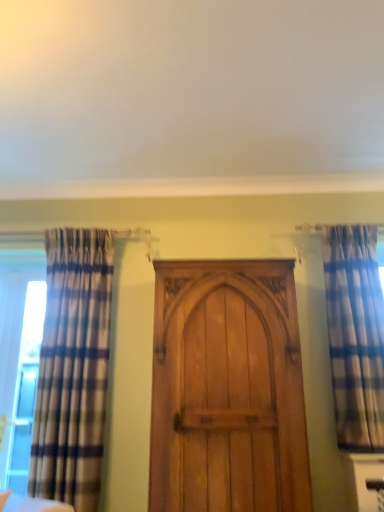
At what (x,y) coordinates should I click in order to perform the action: click on clear glass window at left. Please return your answer as a coordinate pair (x, y). This screenshot has height=512, width=384. Looking at the image, I should click on (19, 358).

What do you see at coordinates (31, 504) in the screenshot?
I see `wooden door at center` at bounding box center [31, 504].

In order to click on plaid fabric curtain at left, the second curtain in the right-to-left sequence in this screenshot , I will do `click(73, 369)`.

At what (x,y) coordinates should I click in order to perform the action: click on plaid fabric curtain at right, the 2th curtain when ordered from left to right. Please return your answer as a coordinate pair (x, y). The width and height of the screenshot is (384, 512). Looking at the image, I should click on (355, 335).

What's the angular difference between light brown wood door at center and wooden door at center's facing directions?

They differ by 36.6 degrees in their facing directions.

Is point (219, 308) farther from camera compared to point (15, 507)?

Yes, point (219, 308) is behind point (15, 507).

Considering the relative positions of light brown wood door at center and wooden door at center in the image provided, is light brown wood door at center in front of wooden door at center?

No.

Could you tell me if light brown wood door at center is facing wooden door at center?

No, light brown wood door at center does not turn towards wooden door at center.

From a real-world perspective, which is physically below, plaid fabric curtain at left, the second curtain in the right-to-left sequence, or light brown wood door at center?

From a 3D spatial view, light brown wood door at center is below.

Considering the relative positions of plaid fabric curtain at left, the second curtain in the right-to-left sequence, and light brown wood door at center in the image provided, is plaid fabric curtain at left, the second curtain in the right-to-left sequence, to the left or to the right of light brown wood door at center?

Based on their positions, plaid fabric curtain at left, the second curtain in the right-to-left sequence, is located to the left of light brown wood door at center.

Would you say plaid fabric curtain at left, the second curtain in the right-to-left sequence, is outside light brown wood door at center?

Yes, plaid fabric curtain at left, the second curtain in the right-to-left sequence, is located beyond the bounds of light brown wood door at center.

Does plaid fabric curtain at left, the second curtain in the right-to-left sequence, lie behind light brown wood door at center?

Yes, it is behind light brown wood door at center.

Based on the photo, from the image's perspective, is wooden door at center under plaid fabric curtain at right, positioned as the first curtain in right-to-left order?

Yes, from the image's perspective, wooden door at center is beneath plaid fabric curtain at right, positioned as the first curtain in right-to-left order.

Is wooden door at center to the left of plaid fabric curtain at right, positioned as the first curtain in right-to-left order, from the viewer's perspective?

Yes, wooden door at center is to the left of plaid fabric curtain at right, positioned as the first curtain in right-to-left order.

How far apart are wooden door at center and plaid fabric curtain at right, positioned as the first curtain in right-to-left order?

wooden door at center and plaid fabric curtain at right, positioned as the first curtain in right-to-left order, are 1.75 meters apart.

Which of these two, wooden door at center or plaid fabric curtain at right, the 2th curtain when ordered from left to right, is wider?

wooden door at center is wider.

In the scene shown: Is light brown wood door at center aimed at plaid fabric curtain at right, positioned as the first curtain in right-to-left order?

No.

Looking at this image, from a real-world perspective, which object rests below the other?

From a 3D spatial view, light brown wood door at center is below.

Considering the relative sizes of light brown wood door at center and plaid fabric curtain at right, positioned as the first curtain in right-to-left order, in the image provided, is light brown wood door at center bigger than plaid fabric curtain at right, positioned as the first curtain in right-to-left order,?

Yes.

How many degrees apart are the facing directions of light brown wood door at center and plaid fabric curtain at right, positioned as the first curtain in right-to-left order?

The angle between the facing direction of light brown wood door at center and the facing direction of plaid fabric curtain at right, positioned as the first curtain in right-to-left order, is 5.62 degrees.

Find the location of a particular element. This screenshot has width=384, height=512. door below the plaid fabric curtain at left, the second curtain in the right-to-left sequence (from a real-world perspective) is located at coordinates click(x=227, y=389).

Is plaid fabric curtain at left, the second curtain in the right-to-left sequence, located within light brown wood door at center?

No, plaid fabric curtain at left, the second curtain in the right-to-left sequence, is located outside of light brown wood door at center.

Who is smaller, light brown wood door at center or plaid fabric curtain at left, the second curtain in the right-to-left sequence?

plaid fabric curtain at left, the second curtain in the right-to-left sequence.

Does light brown wood door at center come in front of plaid fabric curtain at left, the second curtain in the right-to-left sequence?

Yes, light brown wood door at center is in front of plaid fabric curtain at left, the second curtain in the right-to-left sequence.

Is the depth of plaid fabric curtain at right, the 2th curtain when ordered from left to right, greater than that of clear glass window at left?

No, it is in front of clear glass window at left.

Can clear glass window at left be found inside plaid fabric curtain at right, positioned as the first curtain in right-to-left order?

No.

In terms of width, does plaid fabric curtain at right, positioned as the first curtain in right-to-left order, look wider or thinner when compared to clear glass window at left?

Clearly, plaid fabric curtain at right, positioned as the first curtain in right-to-left order, has less width compared to clear glass window at left.

Which is more to the left, plaid fabric curtain at left, which appears as the first curtain when viewed from the left, or wooden door at center?

Positioned to the left is wooden door at center.

At what (x,y) coordinates should I click in order to perform the action: click on the 1st curtain above when counting from the wooden door at center (from the image's perspective). Please return your answer as a coordinate pair (x, y). Looking at the image, I should click on (73, 369).

Looking at this image, can wooden door at center be found inside plaid fabric curtain at left, which appears as the first curtain when viewed from the left?

No, wooden door at center is not inside plaid fabric curtain at left, which appears as the first curtain when viewed from the left.

Is the position of plaid fabric curtain at left, the second curtain in the right-to-left sequence, less distant than that of wooden door at center?

No, it is not.

Where is `furniture in front of the light brown wood door at center`? furniture in front of the light brown wood door at center is located at coordinates (31, 504).

From the image's perspective, starting from the light brown wood door at center, which curtain is the 1st one above? Please provide its 2D coordinates.

[(73, 369)]

Considering their positions, is plaid fabric curtain at right, the 2th curtain when ordered from left to right, positioned closer to clear glass window at left than plaid fabric curtain at left, which appears as the first curtain when viewed from the left?

plaid fabric curtain at left, which appears as the first curtain when viewed from the left.

Which object lies nearer to the anchor point light brown wood door at center, plaid fabric curtain at left, which appears as the first curtain when viewed from the left, or wooden door at center?

Among the two, plaid fabric curtain at left, which appears as the first curtain when viewed from the left, is located nearer to light brown wood door at center.

When comparing their distances from clear glass window at left, does light brown wood door at center or plaid fabric curtain at right, the 2th curtain when ordered from left to right, seem further?

plaid fabric curtain at right, the 2th curtain when ordered from left to right, is positioned further to the anchor clear glass window at left.

Which object lies further to the anchor point plaid fabric curtain at right, positioned as the first curtain in right-to-left order, wooden door at center or clear glass window at left?

clear glass window at left is further to plaid fabric curtain at right, positioned as the first curtain in right-to-left order.

Looking at the image, which one is located closer to plaid fabric curtain at right, positioned as the first curtain in right-to-left order, plaid fabric curtain at left, which appears as the first curtain when viewed from the left, or clear glass window at left?

Among the two, plaid fabric curtain at left, which appears as the first curtain when viewed from the left, is located nearer to plaid fabric curtain at right, positioned as the first curtain in right-to-left order.

Looking at the image, which one is located closer to wooden door at center, plaid fabric curtain at right, positioned as the first curtain in right-to-left order, or clear glass window at left?

clear glass window at left is positioned closer to the anchor wooden door at center.

Looking at the image, which one is located closer to plaid fabric curtain at right, positioned as the first curtain in right-to-left order, wooden door at center or plaid fabric curtain at left, the second curtain in the right-to-left sequence?

plaid fabric curtain at left, the second curtain in the right-to-left sequence.

From the image, which object appears to be nearer to wooden door at center, clear glass window at left or plaid fabric curtain at left, the second curtain in the right-to-left sequence?

plaid fabric curtain at left, the second curtain in the right-to-left sequence.

I want to click on furniture situated between clear glass window at left and light brown wood door at center from left to right, so click(31, 504).

Image resolution: width=384 pixels, height=512 pixels. I want to click on curtain situated between wooden door at center and light brown wood door at center from left to right, so click(73, 369).

Find the location of a particular element. The height and width of the screenshot is (512, 384). curtain situated between wooden door at center and plaid fabric curtain at right, positioned as the first curtain in right-to-left order, from left to right is located at coordinates (73, 369).

The width and height of the screenshot is (384, 512). Identify the location of door between wooden door at center and plaid fabric curtain at right, the 2th curtain when ordered from left to right, from left to right. (227, 389).